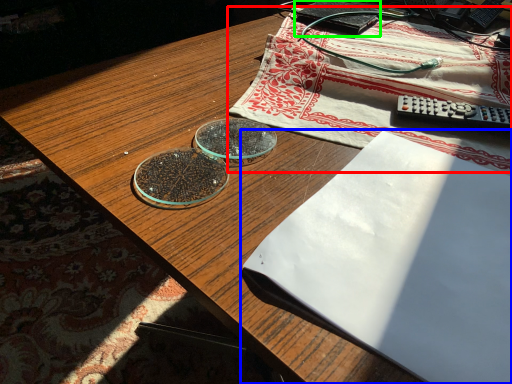
Question: Which object is the farthest from tablecloth (highlighted by a red box)? Choose among these: notebook (highlighted by a blue box) or paperback book (highlighted by a green box).

Choices:
 (A) notebook
 (B) paperback book

Answer: (A)